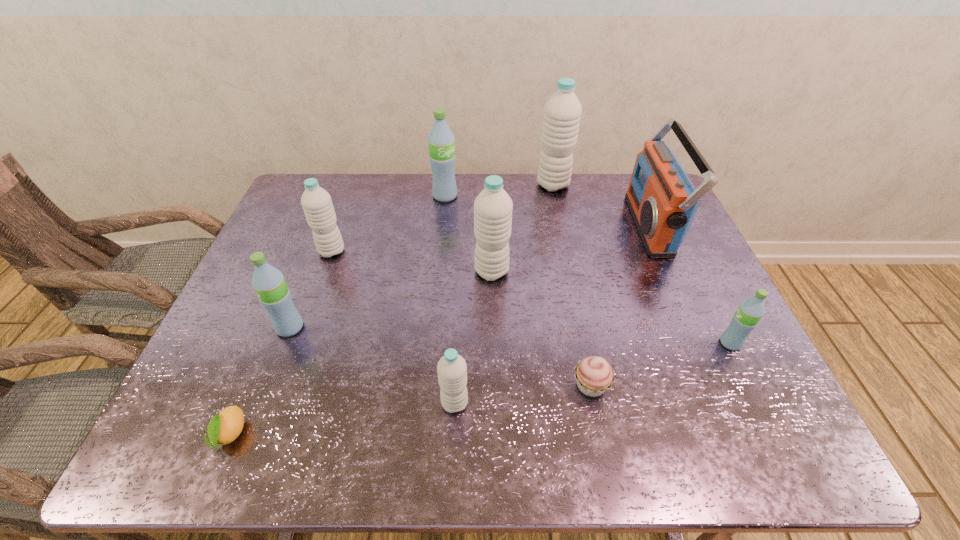
Identify the location of lemon situated at the left edge. This screenshot has width=960, height=540. (226, 426).

Locate an element on the screen. The image size is (960, 540). radio receiver that is at the right edge is located at coordinates (662, 200).

The image size is (960, 540). What are the coordinates of `water bottle located at the right edge` in the screenshot? It's located at (745, 319).

Where is `object at the near left corner`? object at the near left corner is located at coordinates (226, 426).

You are a GUI agent. You are given a task and a screenshot of the screen. Output one action in this format:
    pyautogui.click(x=<x>, y=<y>)
    Task: Click on the object that is positioned at the far right corner
    The image size is (960, 540).
    Given the screenshot: What is the action you would take?
    pyautogui.click(x=662, y=200)

In the image, there is a desktop. At what (x,y) coordinates should I click in order to perform the action: click on free space at the far edge. Please return your answer as a coordinate pair (x, y). Looking at the image, I should click on (503, 176).

Locate an element on the screen. The height and width of the screenshot is (540, 960). free space at the near edge of the desktop is located at coordinates (323, 455).

The image size is (960, 540). Identify the location of free space at the left edge of the desktop. (285, 246).

At what (x,y) coordinates should I click in order to perform the action: click on free space at the right edge. Please return your answer as a coordinate pair (x, y). Looking at the image, I should click on (690, 255).

At what (x,y) coordinates should I click in order to perform the action: click on unoccupied position between the third white water bottle from right to left and the blue radio receiver. Please return your answer as a coordinate pair (x, y). Looking at the image, I should click on (552, 314).